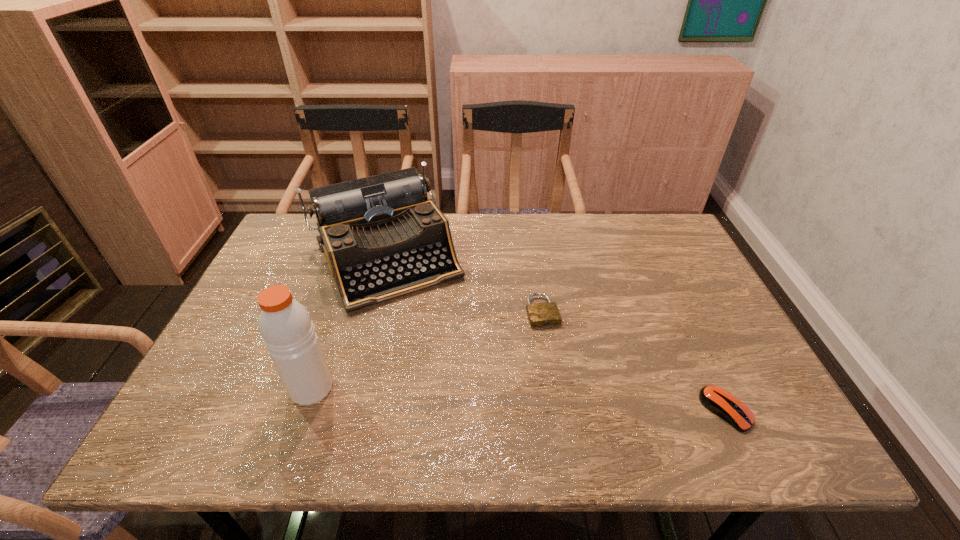
Locate an element on the screen. free space on the desktop that is between the shaker and the third tallest object and is positioned on the keyhole side of the shortest object is located at coordinates (573, 402).

At what (x,y) coordinates should I click in order to perform the action: click on free space on the desktop that is between the tallest object and the computer mouse and is positioned on the keyboard of the second tallest object. Please return your answer as a coordinate pair (x, y). Looking at the image, I should click on (457, 396).